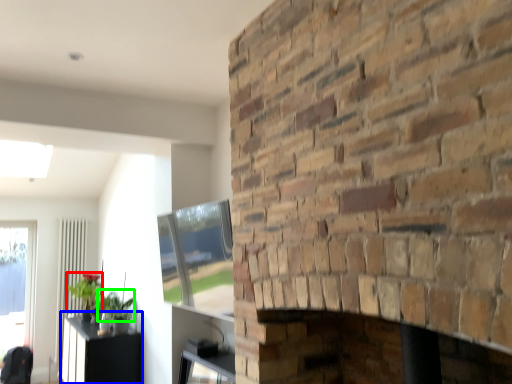
Question: Based on their relative distances, which object is farther from plant (highlighted by a red box)? Choose from table (highlighted by a blue box) and plant (highlighted by a green box).

Choices:
 (A) table
 (B) plant

Answer: (A)